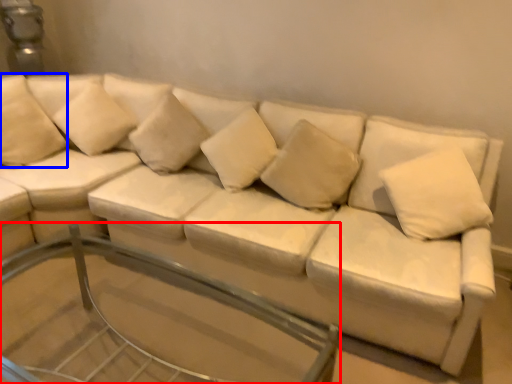
Question: Which object is closer to the camera taking this photo, glass table (highlighted by a red box) or pillow (highlighted by a blue box)?

Choices:
 (A) glass table
 (B) pillow

Answer: (A)